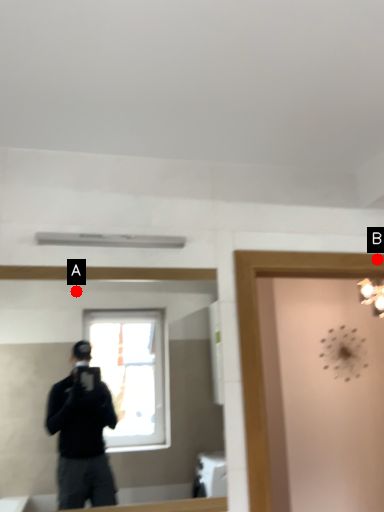
Question: Two points are circled on the image, labeled by A and B beside each circle. Which point is closer to the camera?

Choices:
 (A) A is closer
 (B) B is closer

Answer: (B)